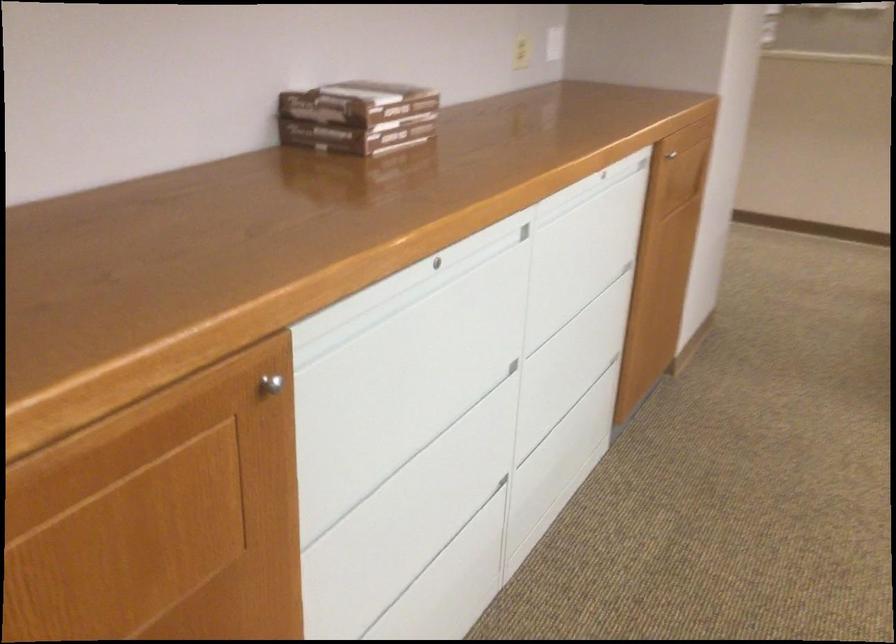
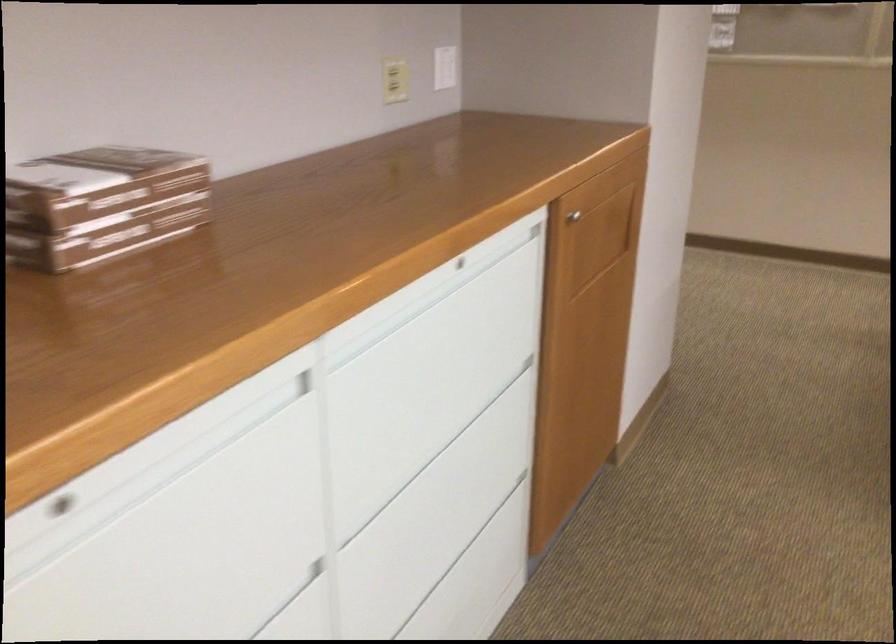
In a continuous first-person perspective shot, in which direction is the camera moving?

The movement direction of the cameraman is right, forward.